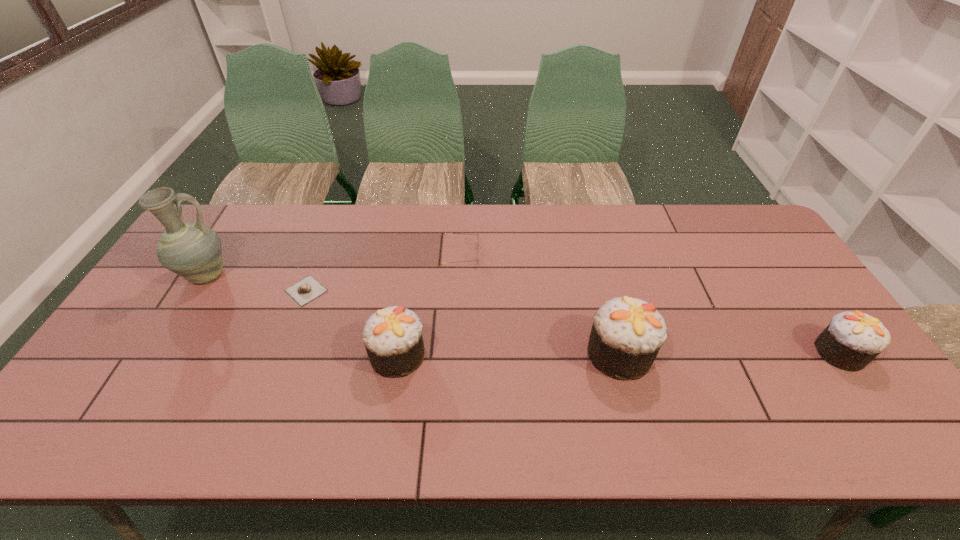
At what (x,y) coordinates should I click in order to perform the action: click on spectacles. Please return your answer as a coordinate pair (x, y). Looking at the image, I should click on (445, 233).

Where is `free space located 0.330m on the right of the leftmost cupcake`? This screenshot has width=960, height=540. free space located 0.330m on the right of the leftmost cupcake is located at coordinates (555, 355).

Find the location of a particular element. The height and width of the screenshot is (540, 960). vacant space located on the right of the second object from right to left is located at coordinates (695, 354).

Where is `free spot located 0.340m on the left of the shortest cupcake`? This screenshot has height=540, width=960. free spot located 0.340m on the left of the shortest cupcake is located at coordinates (686, 353).

Find the location of a particular element. blank area located 0.170m on the left of the shortest object is located at coordinates (226, 291).

The height and width of the screenshot is (540, 960). In order to click on blank space located on the handle side of the leftmost object in this screenshot , I will do `click(357, 275)`.

Where is `vacant space situated 0.270m on the temples of the fifth tallest object`? Image resolution: width=960 pixels, height=540 pixels. vacant space situated 0.270m on the temples of the fifth tallest object is located at coordinates (564, 254).

This screenshot has height=540, width=960. What are the coordinates of `object that is at the far edge` in the screenshot? It's located at (445, 233).

Image resolution: width=960 pixels, height=540 pixels. I want to click on object at the left edge, so click(x=192, y=250).

Locate an element on the screen. The image size is (960, 540). object at the right edge is located at coordinates (852, 340).